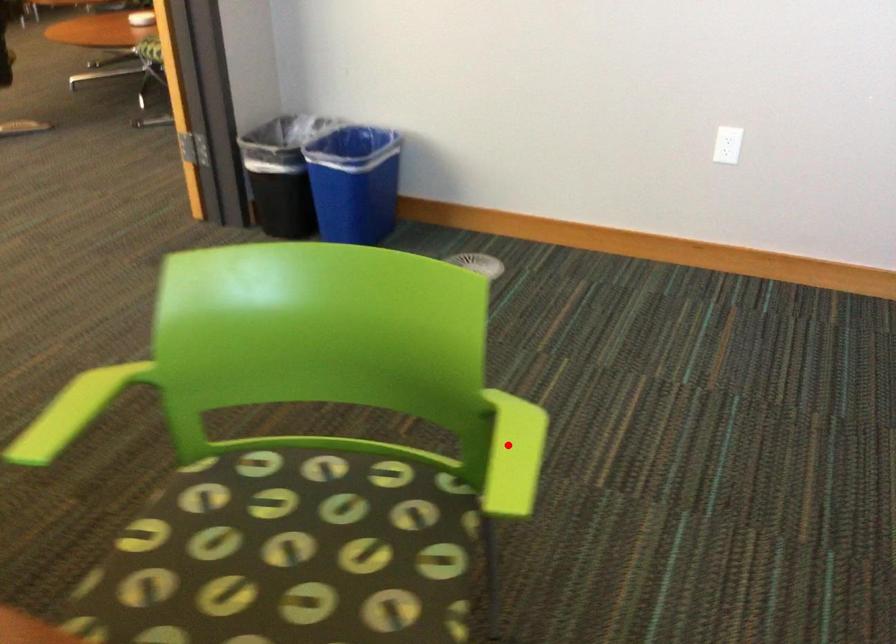
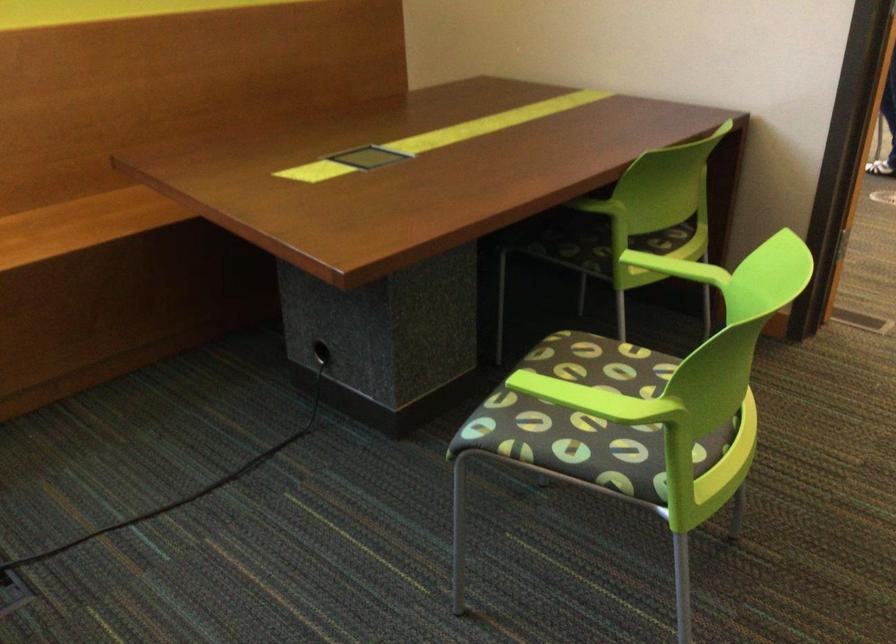
Question: I am providing you with two images of the same scene from different viewpoints. Given a red point in image1, look at the same physical point in image2. Is it:

Choices:
 (A) Closer to the viewpoint
 (B) Farther from the viewpoint

Answer: (B)